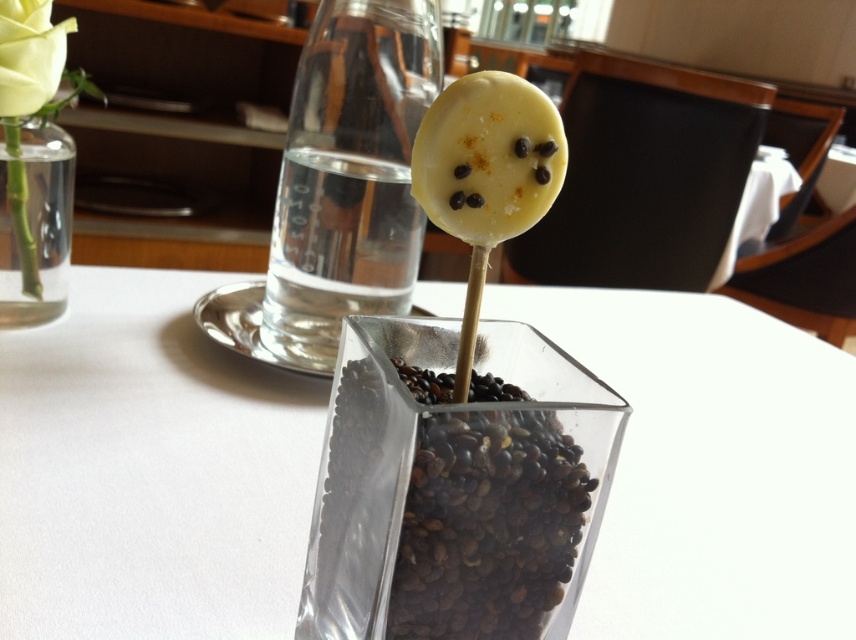
Question: Which object is closer to the camera taking this photo?

Choices:
 (A) transparent glass vase at center
 (B) yellow matte cookie at center
 (C) clear glass vase at left

Answer: (B)

Question: Considering the relative positions of clear glass vase at left and matte yellow rose at upper left in the image provided, where is clear glass vase at left located with respect to matte yellow rose at upper left?

Choices:
 (A) right
 (B) left

Answer: (B)

Question: Which point is closer to the camera?

Choices:
 (A) clear glass vase at left
 (B) yellow matte cookie at center

Answer: (B)

Question: Which of these objects is positioned closest to the transparent glass vase at center?

Choices:
 (A) clear glass vase at left
 (B) matte yellow rose at upper left
 (C) yellow matte cookie at center

Answer: (C)

Question: Does transparent glass vase at center have a larger size compared to clear glass vase at left?

Choices:
 (A) no
 (B) yes

Answer: (B)

Question: Is yellow matte cookie at center to the right of clear glass vase at left from the viewer's perspective?

Choices:
 (A) yes
 (B) no

Answer: (A)